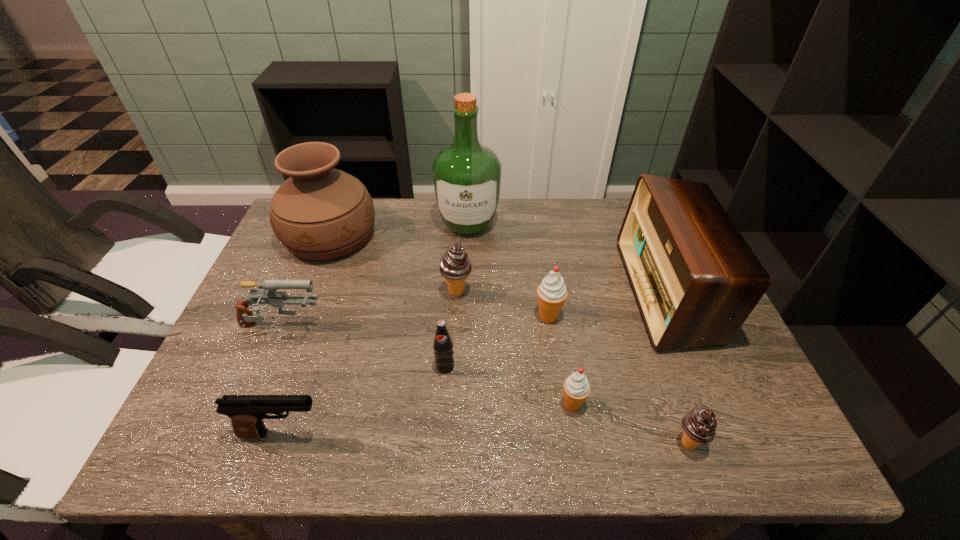
At what (x,y) coordinates should I click in order to perform the action: click on free spot between the gun and the nearer red icecream. Please return your answer as a coordinate pair (x, y). The image size is (960, 540). Looking at the image, I should click on [426, 367].

Identify the location of empty space between the nearer red icecream and the bigger red icecream. (561, 360).

This screenshot has height=540, width=960. In order to click on vacant space in between the gun and the nearer red icecream in this screenshot , I will do `click(426, 367)`.

You are a GUI agent. You are given a task and a screenshot of the screen. Output one action in this format:
    pyautogui.click(x=<x>, y=<y>)
    Task: Click on the object that can be found as the ninth closest to the liquor
    The width and height of the screenshot is (960, 540).
    Given the screenshot: What is the action you would take?
    pyautogui.click(x=699, y=425)

You are a GUI agent. You are given a task and a screenshot of the screen. Output one action in this format:
    pyautogui.click(x=<x>, y=<y>)
    Task: Click on the object that can be found as the sixth closest to the pistol
    The width and height of the screenshot is (960, 540).
    Given the screenshot: What is the action you would take?
    pyautogui.click(x=551, y=293)

Locate which icecream ranks second in proximity to the second nearest icecream. Please provide its 2D coordinates. Your answer should be formatted as a tuple, i.e. [(x, y)], where the tuple contains the x and y coordinates of a point satisfying the conditions above.

[(551, 293)]

Select which icecream is the second closest to the radio receiver. Please provide its 2D coordinates. Your answer should be formatted as a tuple, i.e. [(x, y)], where the tuple contains the x and y coordinates of a point satisfying the conditions above.

[(551, 293)]

The image size is (960, 540). I want to click on free point that satisfies the following two spatial constraints: 1. on the front-facing side of the nearest icecream; 2. on the right side of the liquor, so click(461, 443).

Find the location of a particular element. The width and height of the screenshot is (960, 540). free space that satisfies the following two spatial constraints: 1. on the front side of the smaller chocolate icecream; 2. on the left side of the bigger chocolate icecream is located at coordinates (449, 443).

You are a GUI agent. You are given a task and a screenshot of the screen. Output one action in this format:
    pyautogui.click(x=<x>, y=<y>)
    Task: Click on the vacant space that satisfies the following two spatial constraints: 1. on the front side of the right chocolate icecream; 2. on the left side of the third farthest icecream
    The height and width of the screenshot is (540, 960).
    Given the screenshot: What is the action you would take?
    pyautogui.click(x=579, y=443)